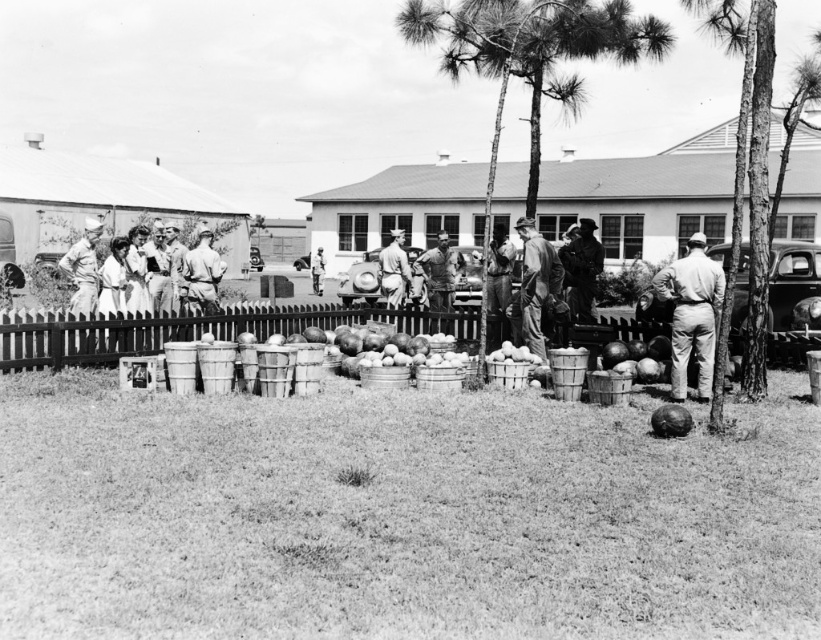
You are a photographer taking a picture of the workers in this historical scene. You want to ensure both the light brown fabric pants at right and the light blue uniform at center are clearly visible. Which worker should you focus on to capture the larger clothing item?

The light blue uniform at center is larger in size compared to the light brown fabric pants at right, so focusing on the light blue uniform at center will ensure the larger clothing item is clearly visible.